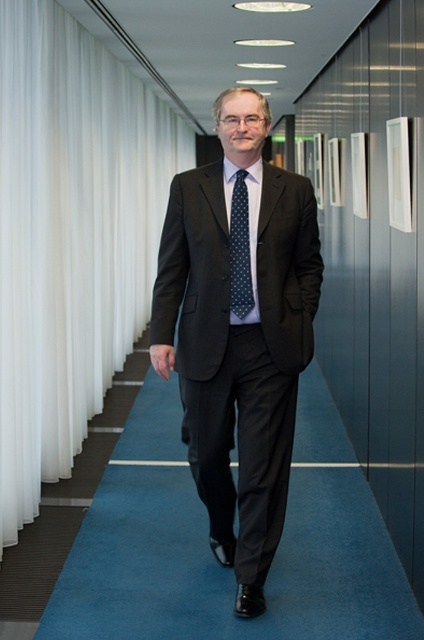
You are a security camera positioned in the hallway. You need to determine if the distance between the white sheer curtain at left and the dark green dotted tie at center is greater than 8 feet. What is your observation?

The white sheer curtain at left and dark green dotted tie at center are 8.11 feet apart from each other, so the distance is greater than 8 feet.

You are standing in the hallway and see two points marked on the floor. The first point is at coordinate point [106,134] and the second point is at coordinate point [256,376]. Which point is closer to you?

Point [106,134] is closer to you because it is further to the viewer than point [256,376].